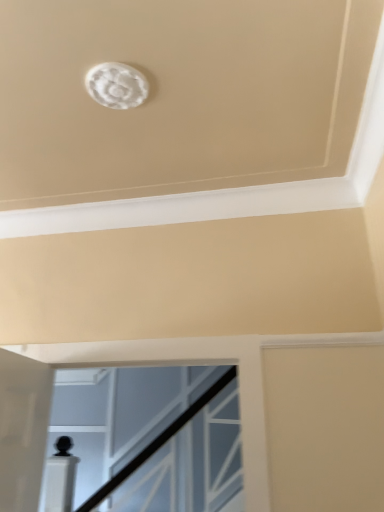
From the picture: In order to face white matte decorative element at upper center, should I rotate leftwards or rightwards?

It's best to rotate left around 9.929 degrees.

What are the coordinates of `white matte decorative element at upper center` in the screenshot? It's located at (116, 85).

Image resolution: width=384 pixels, height=512 pixels. What do you see at coordinates (116, 85) in the screenshot?
I see `white matte decorative element at upper center` at bounding box center [116, 85].

Find the location of a particular element. white matte decorative element at upper center is located at coordinates (116, 85).